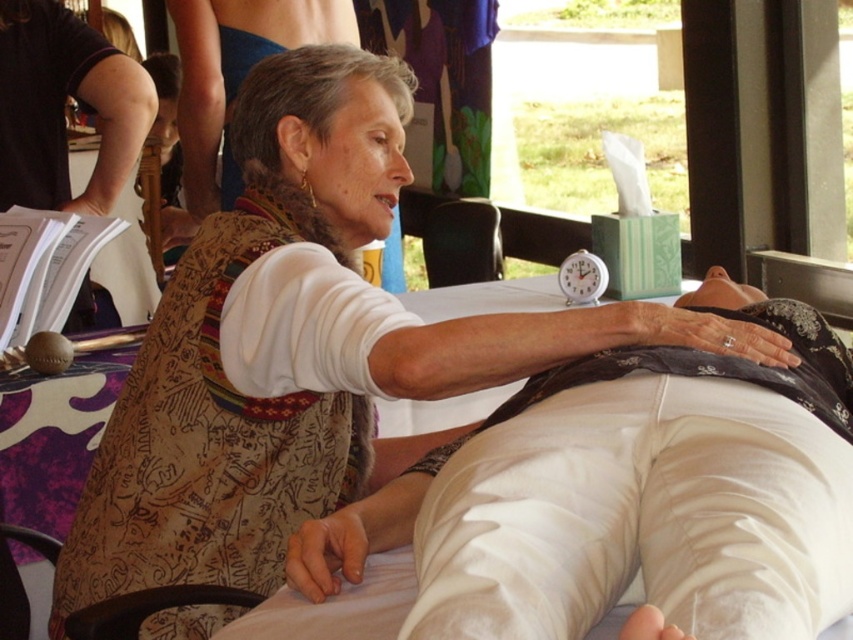
Between white cotton pants at center and white plastic alarm clock at upper center, which one is positioned higher?

Positioned higher is white plastic alarm clock at upper center.

Is white cotton pants at center bigger than white plastic alarm clock at upper center?

Yes, white cotton pants at center is bigger than white plastic alarm clock at upper center.

Does point (838, 554) come farther from viewer compared to point (576, 276)?

No, it is not.

In order to click on white cotton pants at center in this screenshot , I will do click(608, 506).